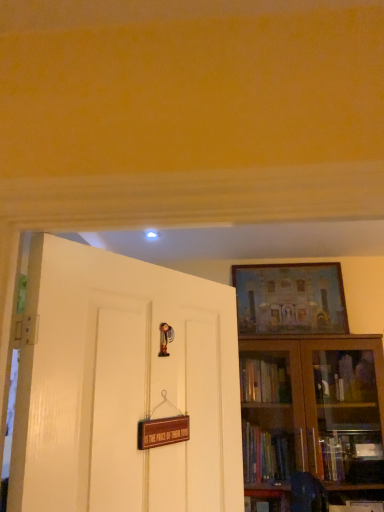
What do you see at coordinates (312, 416) in the screenshot? I see `brown wooden bookcase at right` at bounding box center [312, 416].

In order to face matte wooden picture frame at upper right, should I rotate leftwards or rightwards?

You should rotate right by 12.637 degrees.

The height and width of the screenshot is (512, 384). Find the location of `matte wooden picture frame at upper right`. matte wooden picture frame at upper right is located at coordinates (290, 298).

The image size is (384, 512). What are the coordinates of `brown wooden bookcase at right` in the screenshot? It's located at (312, 416).

How far apart are white glossy door at left and brown wooden bookcase at right?

4.29 feet.

Can you tell me how much white glossy door at left and brown wooden bookcase at right differ in facing direction?

57.7 degrees separate the facing orientations of white glossy door at left and brown wooden bookcase at right.

From a real-world perspective, is white glossy door at left located beneath brown wooden bookcase at right?

Actually, white glossy door at left is physically above brown wooden bookcase at right in the real world.

In terms of width, does white glossy door at left look wider or thinner when compared to brown wooden bookcase at right?

In the image, white glossy door at left appears to be more narrow than brown wooden bookcase at right.

Looking at this image, from the image's perspective, relative to matte wooden picture frame at upper right, is brown wooden bookcase at right above or below?

brown wooden bookcase at right is situated lower than matte wooden picture frame at upper right in the image.

The height and width of the screenshot is (512, 384). I want to click on bookcase in front of the matte wooden picture frame at upper right, so click(312, 416).

Measure the distance between matte wooden picture frame at upper right and brown wooden bookcase at right.

A distance of 18.03 inches exists between matte wooden picture frame at upper right and brown wooden bookcase at right.

Is brown wooden bookcase at right located within matte wooden picture frame at upper right?

No, brown wooden bookcase at right is located outside of matte wooden picture frame at upper right.

From the image's perspective, is matte wooden picture frame at upper right located above or below brown wooden bookcase at right?

Based on their image positions, matte wooden picture frame at upper right is located above brown wooden bookcase at right.

Can you tell me how much matte wooden picture frame at upper right and brown wooden bookcase at right differ in facing direction?

1.38 degrees.

From the picture: Does white glossy door at left have a greater height compared to matte wooden picture frame at upper right?

Yes.

Considering the positions of objects white glossy door at left and matte wooden picture frame at upper right in the image provided, who is more to the right, white glossy door at left or matte wooden picture frame at upper right?

matte wooden picture frame at upper right is more to the right.

Is white glossy door at left wider than matte wooden picture frame at upper right?

Yes, white glossy door at left is wider than matte wooden picture frame at upper right.

Locate an element on the screen. picture frame behind the white glossy door at left is located at coordinates (290, 298).

Is there a large distance between brown wooden bookcase at right and white glossy door at left?

Yes, brown wooden bookcase at right and white glossy door at left are located far from each other.

Which object is closer to the camera, brown wooden bookcase at right or white glossy door at left?

white glossy door at left is in front.

How far apart are brown wooden bookcase at right and white glossy door at left?

4.29 feet.

What's the angular difference between brown wooden bookcase at right and white glossy door at left's facing directions?

57.7 degrees.

Considering the relative sizes of matte wooden picture frame at upper right and white glossy door at left in the image provided, is matte wooden picture frame at upper right wider than white glossy door at left?

No.

Is white glossy door at left completely or partially inside matte wooden picture frame at upper right?

No, white glossy door at left is located outside of matte wooden picture frame at upper right.

Is matte wooden picture frame at upper right looking in the opposite direction of white glossy door at left?

No, matte wooden picture frame at upper right is not facing away from white glossy door at left.

Find the location of a particular element. door above the brown wooden bookcase at right (from a real-world perspective) is located at coordinates (123, 386).

The width and height of the screenshot is (384, 512). I want to click on bookcase that appears on the right of matte wooden picture frame at upper right, so click(x=312, y=416).

Estimate the real-world distances between objects in this image. Which object is closer to matte wooden picture frame at upper right, brown wooden bookcase at right or white glossy door at left?

brown wooden bookcase at right is positioned closer to the anchor matte wooden picture frame at upper right.

Based on their spatial positions, is white glossy door at left or matte wooden picture frame at upper right closer to brown wooden bookcase at right?

The object closer to brown wooden bookcase at right is matte wooden picture frame at upper right.

From the image, which object appears to be farther from white glossy door at left, brown wooden bookcase at right or matte wooden picture frame at upper right?

Based on the image, matte wooden picture frame at upper right appears to be further to white glossy door at left.

From the image, which object appears to be nearer to matte wooden picture frame at upper right, white glossy door at left or brown wooden bookcase at right?

Based on the image, brown wooden bookcase at right appears to be nearer to matte wooden picture frame at upper right.

Considering their positions, is matte wooden picture frame at upper right positioned closer to white glossy door at left than brown wooden bookcase at right?

Based on the image, brown wooden bookcase at right appears to be nearer to white glossy door at left.

Based on their spatial positions, is matte wooden picture frame at upper right or white glossy door at left closer to brown wooden bookcase at right?

Among the two, matte wooden picture frame at upper right is located nearer to brown wooden bookcase at right.

The width and height of the screenshot is (384, 512). I want to click on bookcase positioned between white glossy door at left and matte wooden picture frame at upper right from near to far, so click(x=312, y=416).